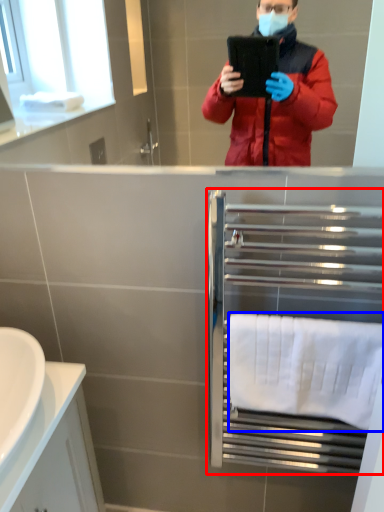
Question: Among these objects, which one is nearest to the camera, balustrade (highlighted by a red box) or towel/napkin (highlighted by a blue box)?

Choices:
 (A) balustrade
 (B) towel/napkin

Answer: (A)